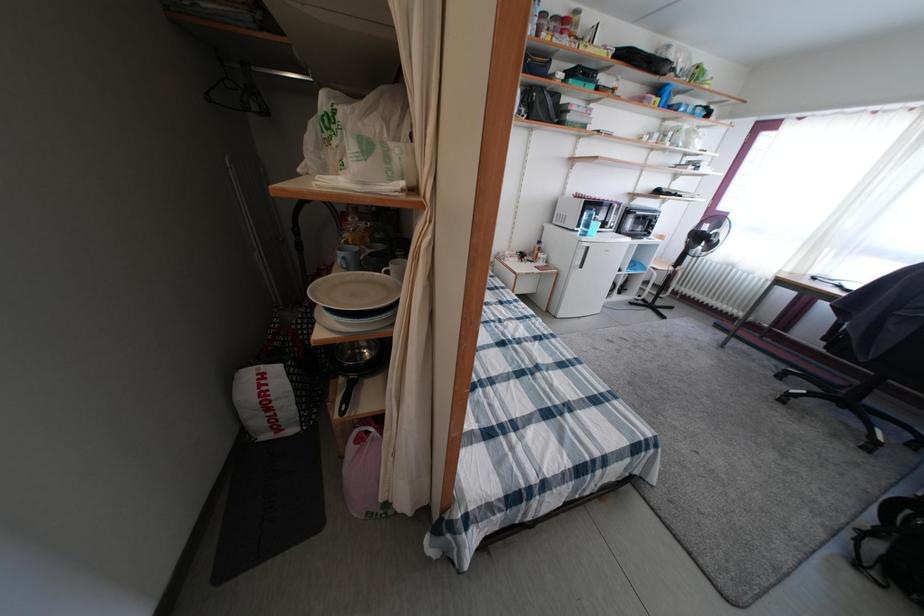
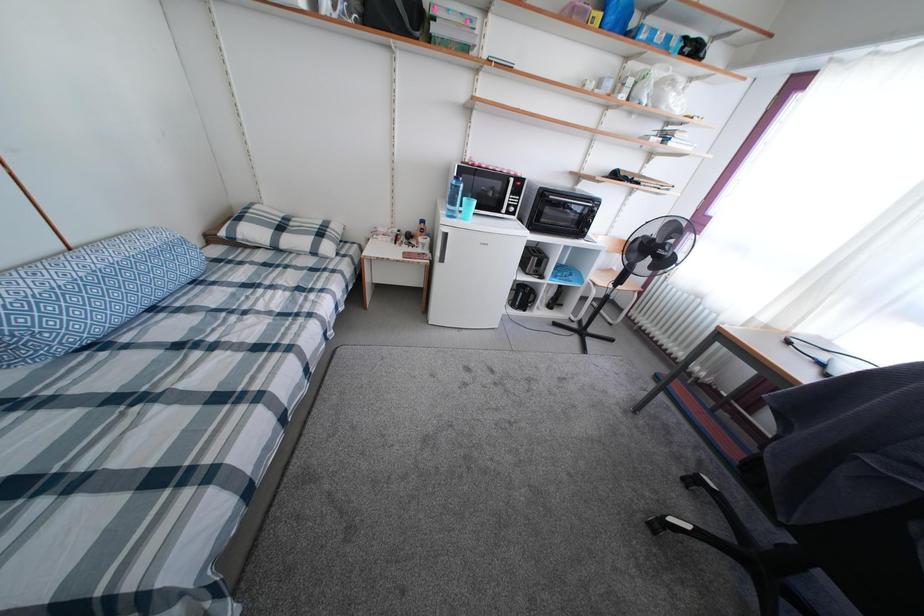
What movement of the cameraman would produce the second image?

The movement direction of the cameraman is right, forward.